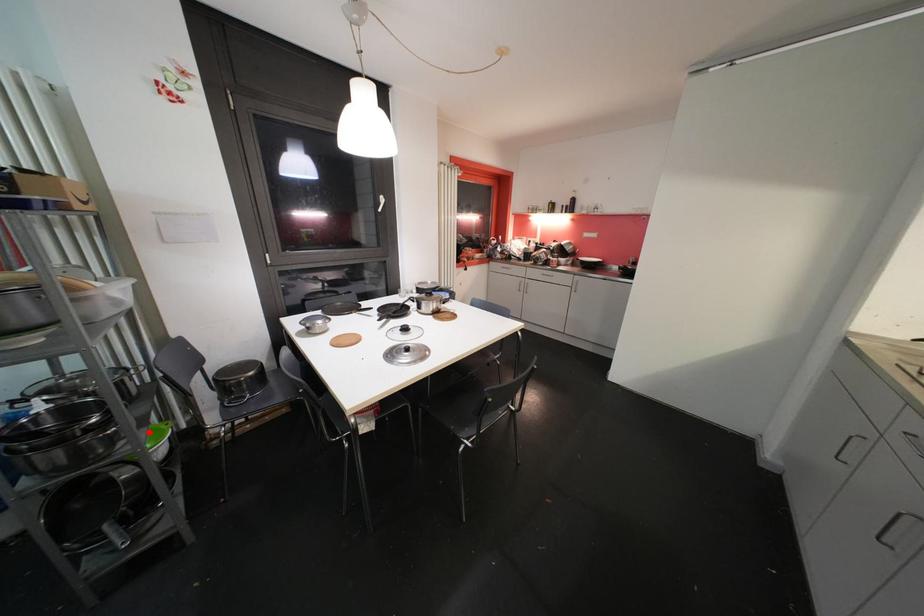
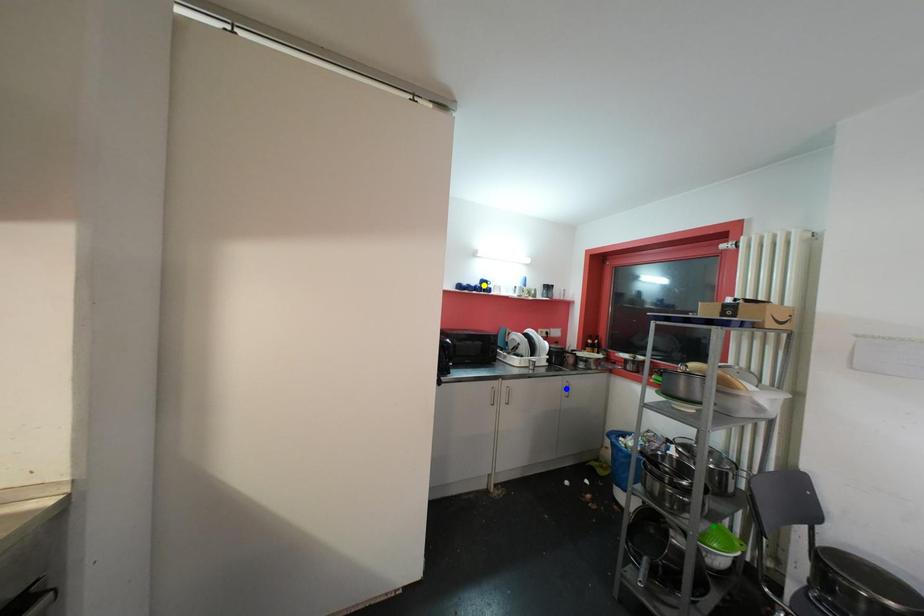
Question: I am providing you with two images of the same scene from different viewpoints. A red point is marked on the first image. You are given multiple points on the second image. In image 2, which mark is for the same physical point as the one in image 1?

Choices:
 (A) yellow point
 (B) green point
 (C) blue point

Answer: (B)